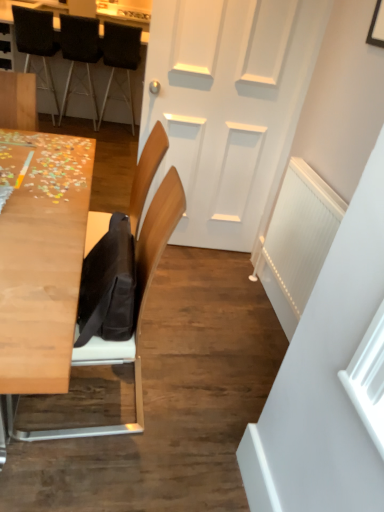
The width and height of the screenshot is (384, 512). What are the coordinates of `free area in between white plastic radiator at right and light wood table at left, the 1th table when ordered from front to back` in the screenshot? It's located at (203, 344).